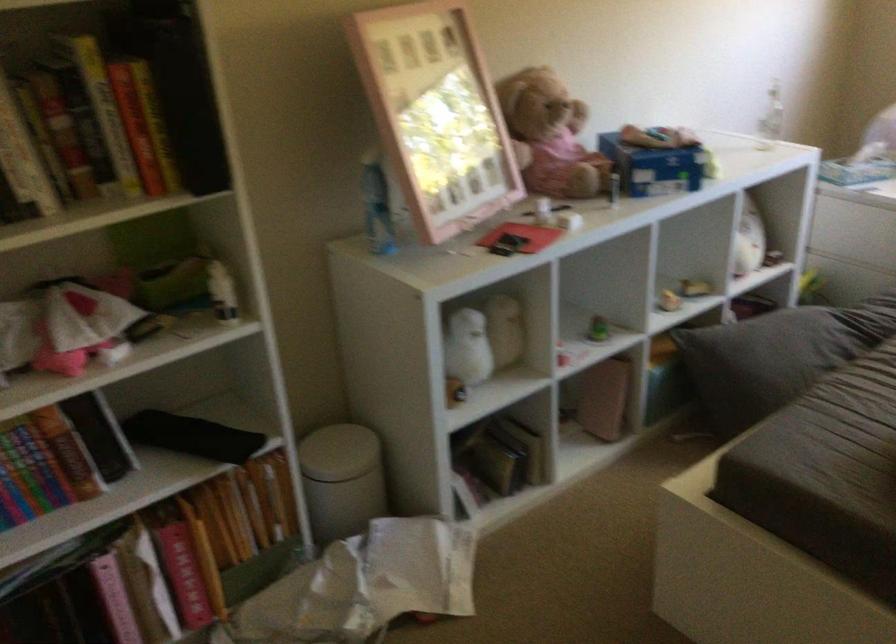
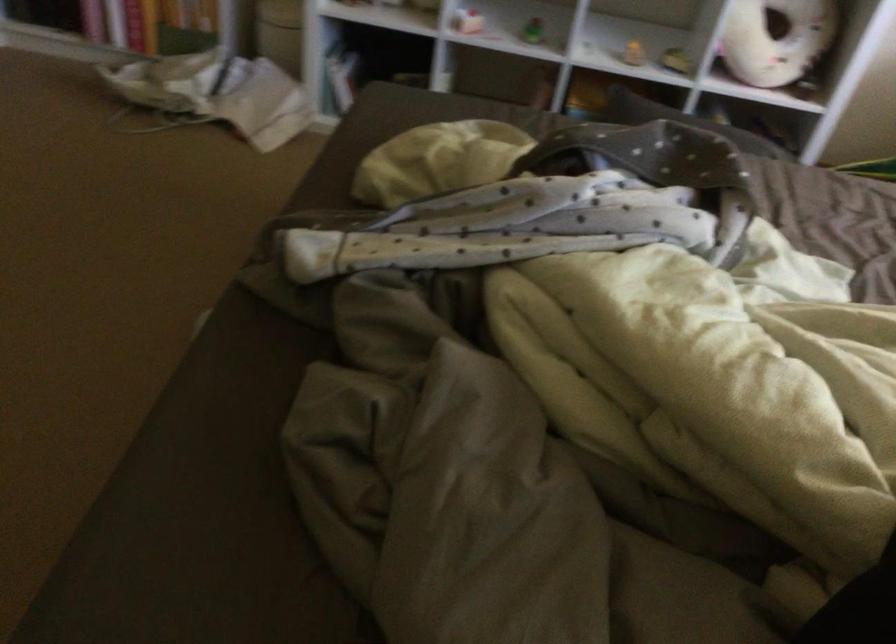
The point at [780,237] is marked in the first image. Where is the corresponding point in the second image?

(777, 40)